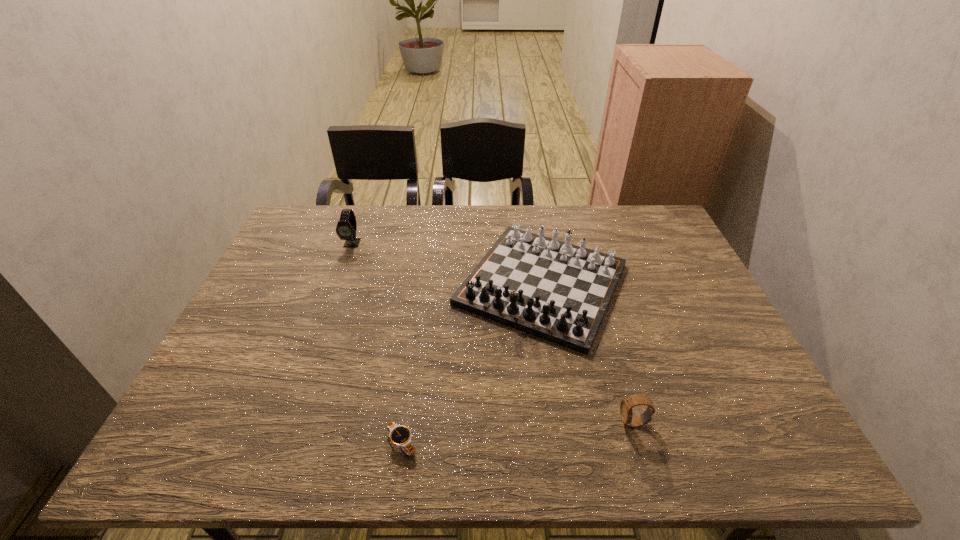
Locate an element on the screen. the tallest watch is located at coordinates [x=346, y=228].

Identify the location of the farthest watch. This screenshot has width=960, height=540. pos(346,228).

Where is `chessboard`? chessboard is located at coordinates (557, 291).

Locate an element on the screen. Image resolution: width=960 pixels, height=540 pixels. the rightmost watch is located at coordinates (626, 404).

I want to click on the second watch from left to right, so tap(400, 436).

I want to click on the shortest object, so click(400, 436).

Find the location of `vacant space located 0.360m on the face of the tallest watch`. vacant space located 0.360m on the face of the tallest watch is located at coordinates (317, 341).

Locate an element on the screen. This screenshot has height=540, width=960. vacant region located on the left of the chessboard is located at coordinates (381, 284).

Identify the location of free point located 0.150m on the face of the second tallest watch. point(548,423).

Find the location of a particular element. This screenshot has height=540, width=960. free space located on the face of the second tallest watch is located at coordinates (495, 423).